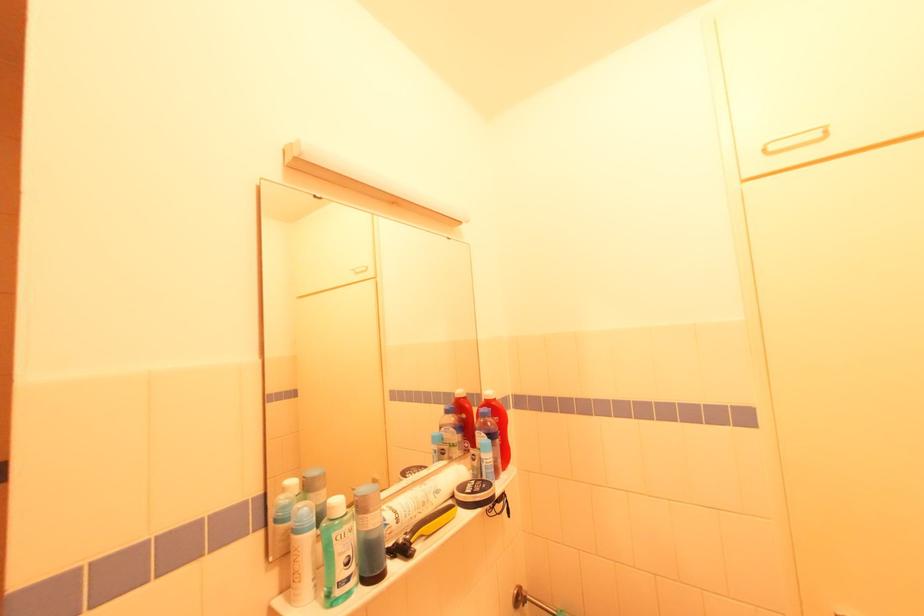
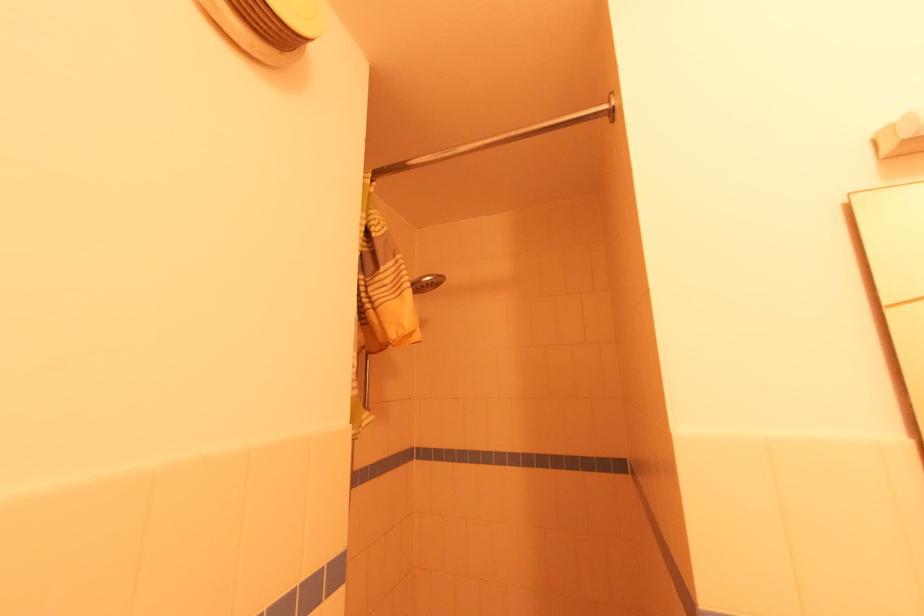
Question: The first image is from the beginning of the video and the second image is from the end. How did the camera likely rotate when shooting the video?

Choices:
 (A) Left
 (B) Right
 (C) Up
 (D) Down

Answer: (A)